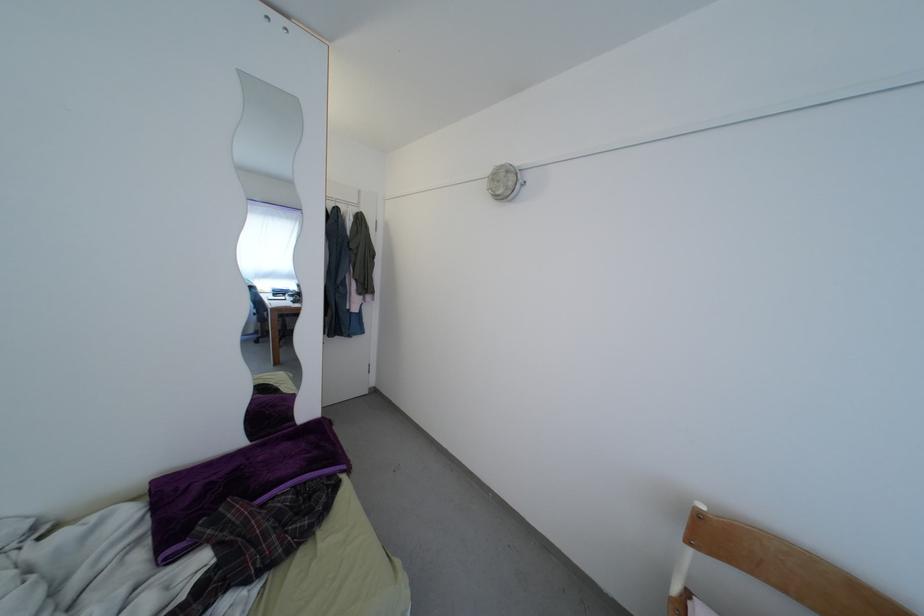
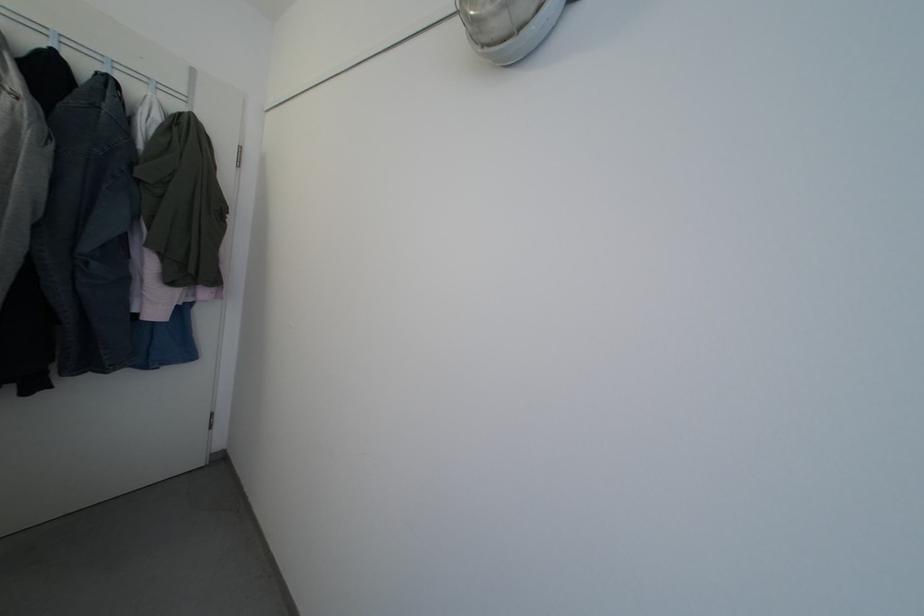
Question: The first image is from the beginning of the video and the second image is from the end. How did the camera likely rotate when shooting the video?

Choices:
 (A) Left
 (B) Right
 (C) Up
 (D) Down

Answer: (B)